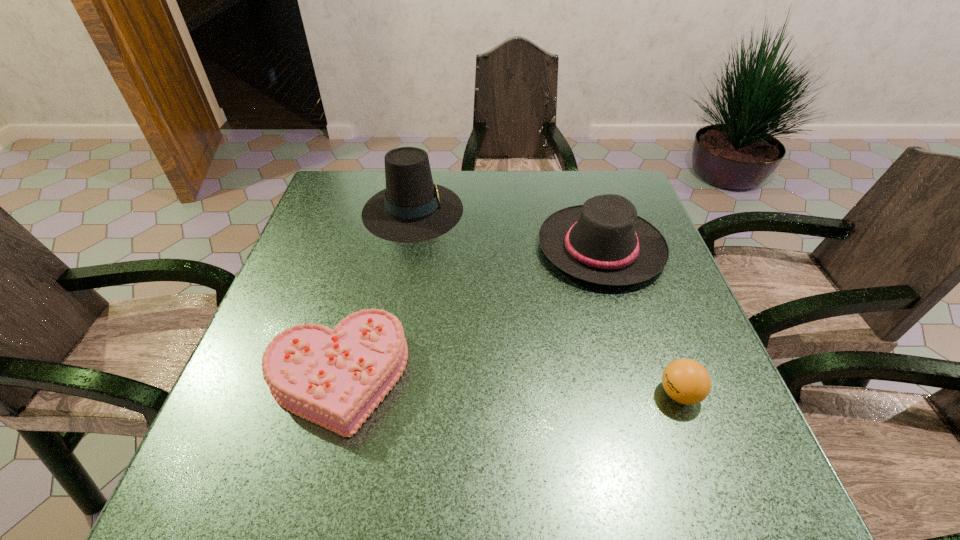
Locate an element on the screen. free space between the cake and the shorter dress hat is located at coordinates (469, 312).

Locate an element on the screen. unoccupied position between the taller dress hat and the cake is located at coordinates (375, 293).

Where is `unoccupied position between the cake and the tallest object`? The image size is (960, 540). unoccupied position between the cake and the tallest object is located at coordinates (375, 293).

In order to click on empty location between the shorter dress hat and the taller dress hat in this screenshot , I will do pyautogui.click(x=507, y=229).

The image size is (960, 540). In order to click on free spot between the tallest object and the cake in this screenshot , I will do `click(375, 293)`.

Select which object appears as the second closest to the left dress hat. Please provide its 2D coordinates. Your answer should be formatted as a tuple, i.e. [(x, y)], where the tuple contains the x and y coordinates of a point satisfying the conditions above.

[(335, 378)]

Point out which object is positioned as the third nearest to the ping-pong ball. Please provide its 2D coordinates. Your answer should be formatted as a tuple, i.e. [(x, y)], where the tuple contains the x and y coordinates of a point satisfying the conditions above.

[(411, 209)]

Image resolution: width=960 pixels, height=540 pixels. Find the location of `free spot that satisfies the following two spatial constraints: 1. on the front-facing side of the taller dress hat; 2. on the back side of the shorter dress hat`. free spot that satisfies the following two spatial constraints: 1. on the front-facing side of the taller dress hat; 2. on the back side of the shorter dress hat is located at coordinates (406, 248).

The height and width of the screenshot is (540, 960). Find the location of `free spot that satisfies the following two spatial constraints: 1. on the front-facing side of the taller dress hat; 2. on the back side of the third shortest object`. free spot that satisfies the following two spatial constraints: 1. on the front-facing side of the taller dress hat; 2. on the back side of the third shortest object is located at coordinates (406, 248).

Locate an element on the screen. The width and height of the screenshot is (960, 540). vacant space that satisfies the following two spatial constraints: 1. on the front-facing side of the left dress hat; 2. on the right side of the right dress hat is located at coordinates (406, 248).